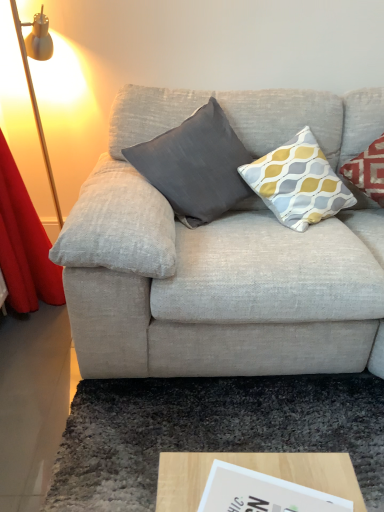
You are a GUI agent. You are given a task and a screenshot of the screen. Output one action in this format:
    pyautogui.click(x=<x>, y=<y>)
    Task: Click on the vacant region above dark gray shaggy rug at lower center (from a real-world perspective)
    
    Given the screenshot: What is the action you would take?
    pyautogui.click(x=241, y=420)